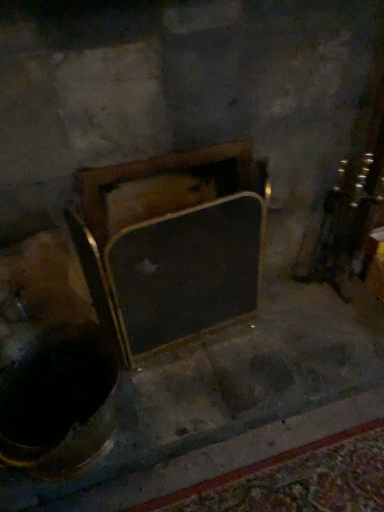
Locate an element on the screen. free point in front of metallic gold frame at center is located at coordinates (199, 382).